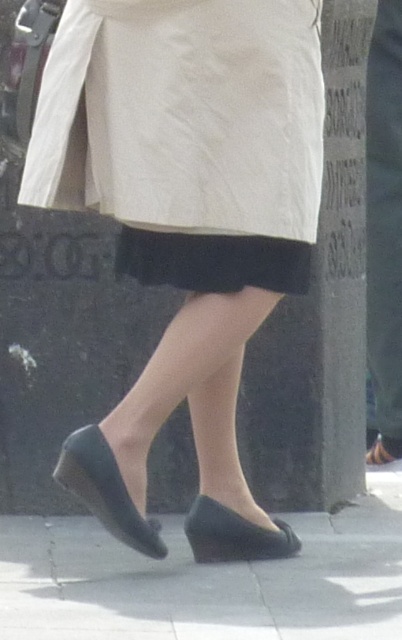
You are standing in a public space and see two points marked on the ground. The first point is at coordinate point (120, 637) and the second is at point (209, 522). If you want to step on both points starting from the nearest one to you, which point should you step on first?

Point (120, 637) is in front of point (209, 522), so you should step on point (120, 637) first as it is closer to you.

You are a fashion designer observing a person in an urban setting. You notice the black rubber shoes at lower center and the black matte skirt at center. Which item is located to the right of the other?

The black rubber shoes at lower center is positioned on the right side of black matte skirt at center.